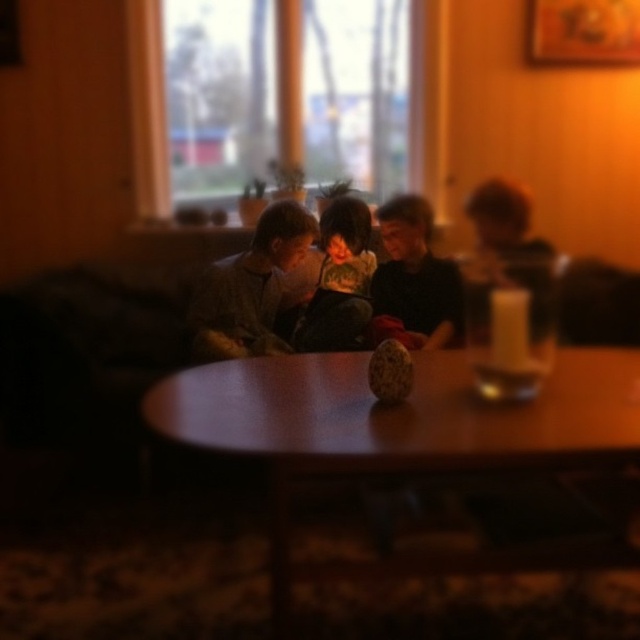
Describe the element at coordinates (388, 419) in the screenshot. I see `wooden table at center` at that location.

Is wooden table at center closer to the viewer compared to dark green textured sweater at center?

Yes, wooden table at center is in front of dark green textured sweater at center.

Describe the element at coordinates (388, 419) in the screenshot. I see `wooden table at center` at that location.

You are a GUI agent. You are given a task and a screenshot of the screen. Output one action in this format:
    pyautogui.click(x=<x>, y=<y>)
    Task: Click on the wooden table at center
    
    Given the screenshot: What is the action you would take?
    pyautogui.click(x=388, y=419)

The height and width of the screenshot is (640, 640). Find the location of `wooden table at center`. wooden table at center is located at coordinates click(388, 419).

Between wooden table at center and smooth black shirt at center, which one is positioned higher?

smooth black shirt at center is higher up.

Is point (240, 372) farther from camera compared to point (404, 332)?

No.

You are a GUI agent. You are given a task and a screenshot of the screen. Output one action in this format:
    pyautogui.click(x=<x>, y=<y>)
    Task: Click on the wooden table at center
    The image size is (640, 640).
    Given the screenshot: What is the action you would take?
    pyautogui.click(x=388, y=419)

Between gray sweater at center and smooth black shirt at center, which one is positioned higher?

Positioned higher is smooth black shirt at center.

Can you confirm if gray sweater at center is shorter than smooth black shirt at center?

In fact, gray sweater at center may be taller than smooth black shirt at center.

Does point (230, 332) come behind point (390, 221)?

No, (230, 332) is closer to viewer.

Find the location of a particular element. gray sweater at center is located at coordinates (250, 288).